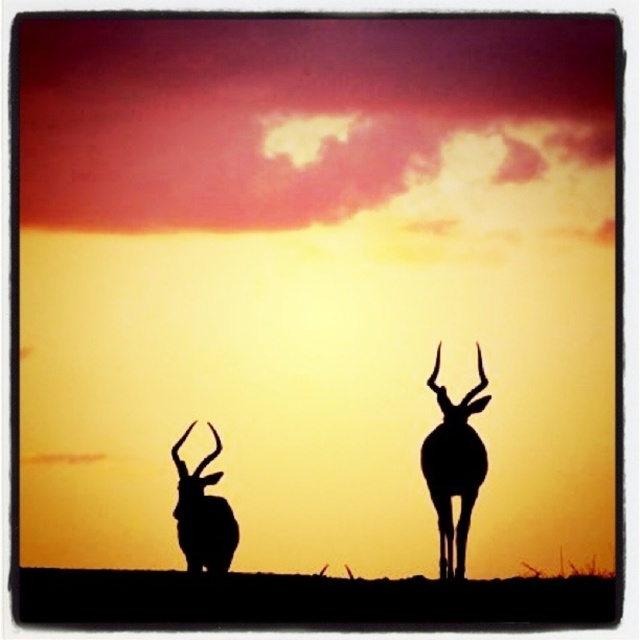
You are an archer aiming to hit both targets located at point (470, 403) and point (202, 513). Which target should you aim for first if you want to shoot the one closer to you?

Point (470, 403) is in front of point (202, 513), so you should aim for point (470, 403) first as it is closer to you.

Looking at this image, you are an astronomer analyzing the sunset scene. You need to determine the position of the silhouette antelope at center relative to the horizon line. Is it above or below the horizon?

The silhouette antelope at center is located at point 0.711 on the y axis, which is below the horizon line since the horizon is typically at the bottom of the sky near the lower edge of the image.